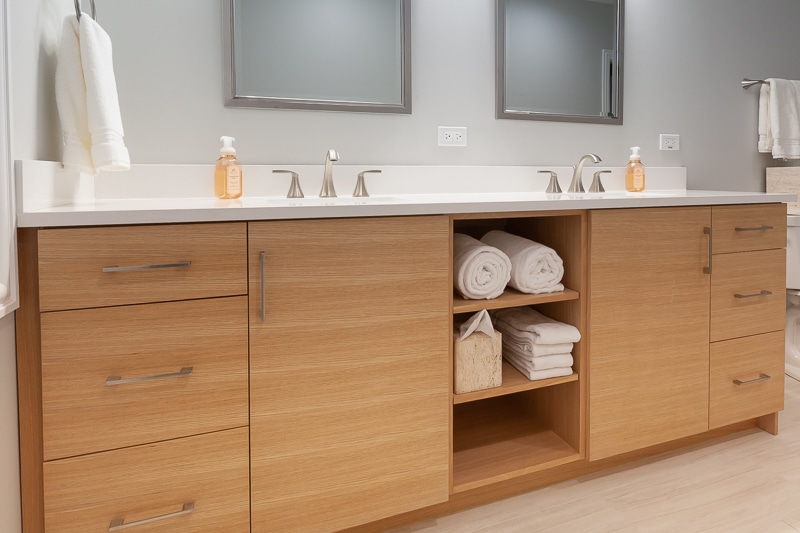
You are a GUI agent. You are given a task and a screenshot of the screen. Output one action in this format:
    pyautogui.click(x=<x>, y=<y>)
    Task: Click on the toilet cloth
    The image size is (800, 533).
    Given the screenshot: What is the action you would take?
    pyautogui.click(x=785, y=124)